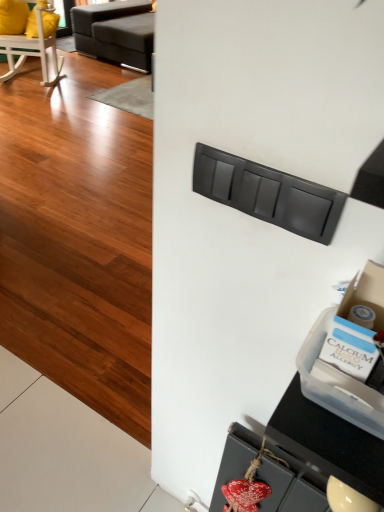
Question: Is matte black drawer at center, the 2th drawer when ordered from back to front, to the right of dark gray fabric studio couch at upper left from the viewer's perspective?

Choices:
 (A) no
 (B) yes

Answer: (B)

Question: Considering the relative sizes of matte black drawer at center, which ranks as the second drawer in bottom-to-top order, and dark gray fabric studio couch at upper left in the image provided, is matte black drawer at center, which ranks as the second drawer in bottom-to-top order, smaller than dark gray fabric studio couch at upper left?

Choices:
 (A) yes
 (B) no

Answer: (A)

Question: Can you confirm if matte black drawer at center, which is the 1th drawer from front to back, is wider than dark gray fabric studio couch at upper left?

Choices:
 (A) yes
 (B) no

Answer: (B)

Question: Is matte black drawer at center, which is the 1th drawer from front to back, thinner than dark gray fabric studio couch at upper left?

Choices:
 (A) yes
 (B) no

Answer: (A)

Question: From a real-world perspective, is matte black drawer at center, which is the 1th drawer from top to bottom, over dark gray fabric studio couch at upper left?

Choices:
 (A) no
 (B) yes

Answer: (B)

Question: Is matte black drawer at center, which is the 1th drawer from front to back, outside dark gray fabric studio couch at upper left?

Choices:
 (A) yes
 (B) no

Answer: (A)

Question: Is dark gray fabric studio couch at upper left not inside wooden rocking chair at upper left?

Choices:
 (A) no
 (B) yes

Answer: (B)

Question: From a real-world perspective, does dark gray fabric studio couch at upper left sit lower than wooden rocking chair at upper left?

Choices:
 (A) no
 (B) yes

Answer: (B)

Question: Would you say dark gray fabric studio couch at upper left is a long distance from wooden rocking chair at upper left?

Choices:
 (A) yes
 (B) no

Answer: (B)

Question: Is wooden rocking chair at upper left a part of dark gray fabric studio couch at upper left?

Choices:
 (A) yes
 (B) no

Answer: (B)

Question: Is dark gray fabric studio couch at upper left oriented towards wooden rocking chair at upper left?

Choices:
 (A) yes
 (B) no

Answer: (A)

Question: From the image's perspective, is dark gray fabric studio couch at upper left under wooden rocking chair at upper left?

Choices:
 (A) yes
 (B) no

Answer: (B)

Question: Would you say matte black drawer at center, the 2th drawer when ordered from back to front, contains wooden rocking chair at upper left?

Choices:
 (A) yes
 (B) no

Answer: (B)